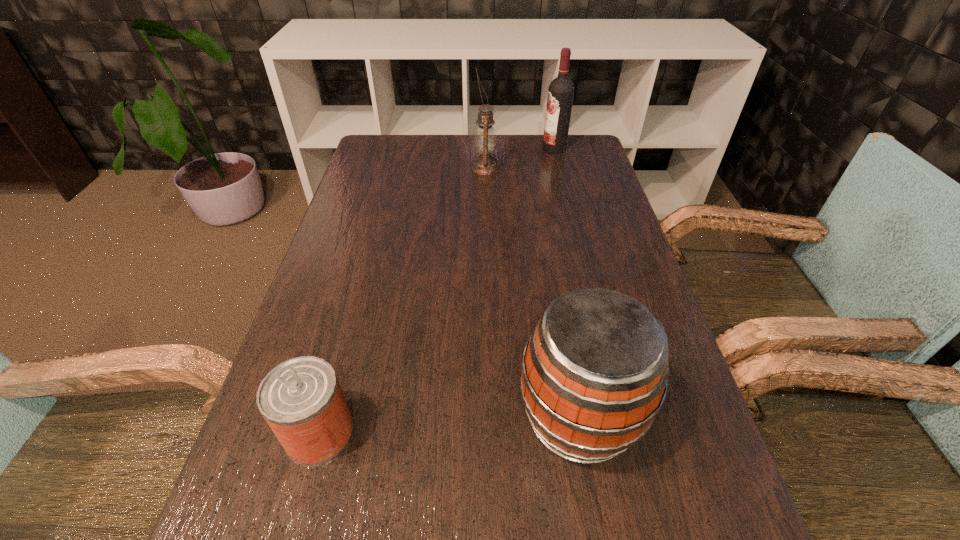
Identify the location of vacant space at the right edge of the desktop. (570, 235).

Identify the location of vacant point located between the second farthest object and the cider. (532, 293).

Where is `empty space between the shortest object and the cider`? empty space between the shortest object and the cider is located at coordinates (449, 424).

This screenshot has width=960, height=540. In order to click on blank region between the cider and the wine bottle in this screenshot , I will do `click(566, 282)`.

This screenshot has width=960, height=540. In order to click on free point between the farthest object and the second farthest object in this screenshot , I will do `click(519, 158)`.

What are the coordinates of `free spot between the oil lamp and the farthest object` in the screenshot? It's located at (519, 158).

Identify the location of empty location between the wine bottle and the second object from left to right. (519, 158).

At what (x,y) coordinates should I click in order to perform the action: click on blank region between the leftmost object and the cider. Please return your answer as a coordinate pair (x, y). Image resolution: width=960 pixels, height=540 pixels. Looking at the image, I should click on (449, 424).

Locate an element on the screen. unoccupied area between the third tallest object and the second farthest object is located at coordinates (532, 293).

Locate which object ranks in proximity to the second object from left to right. Please provide its 2D coordinates. Your answer should be formatted as a tuple, i.e. [(x, y)], where the tuple contains the x and y coordinates of a point satisfying the conditions above.

[(561, 90)]